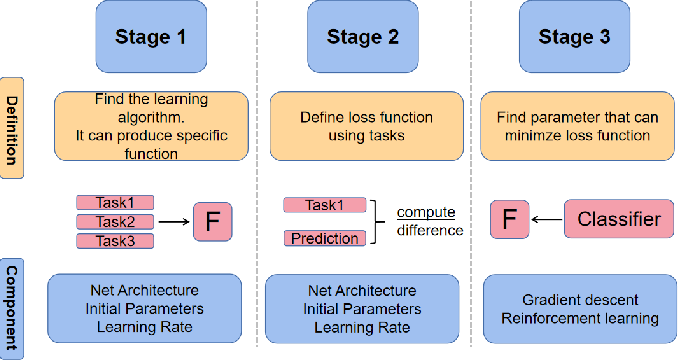
At what (x,y) coordinates should I click in order to perform the action: click on columns. Please return your answer as a coordinate pair (x, y). Looking at the image, I should click on (230, 77), (276, 80), (483, 73).